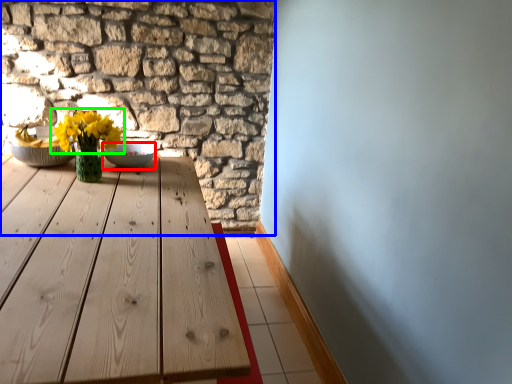
Question: Considering the real-world distances, which object is farthest from bowl (highlighted by a red box)? brickwork (highlighted by a blue box) or flower (highlighted by a green box)?

Choices:
 (A) brickwork
 (B) flower

Answer: (A)